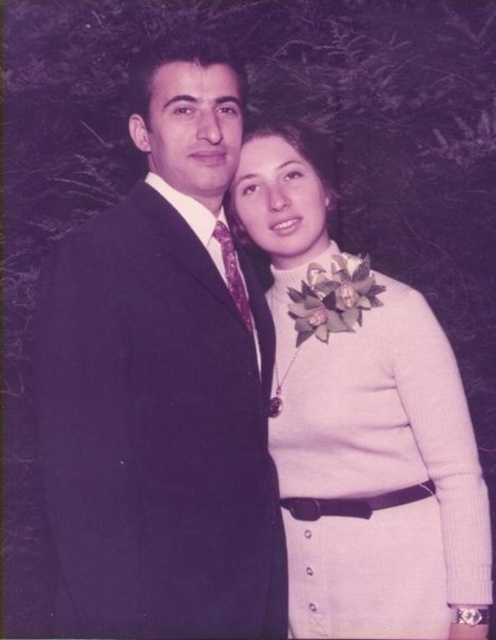
Question: Can you confirm if satin black suit at center is positioned to the left of white knitted dress at center?

Choices:
 (A) no
 (B) yes

Answer: (B)

Question: Which object is farther from the camera taking this photo?

Choices:
 (A) satin black suit at center
 (B) white knitted dress at center

Answer: (B)

Question: Can you confirm if satin black suit at center is thinner than white knitted dress at center?

Choices:
 (A) no
 (B) yes

Answer: (B)

Question: Does satin black suit at center have a greater width compared to white knitted dress at center?

Choices:
 (A) no
 (B) yes

Answer: (A)